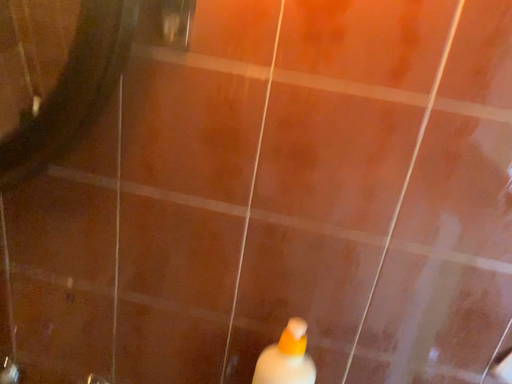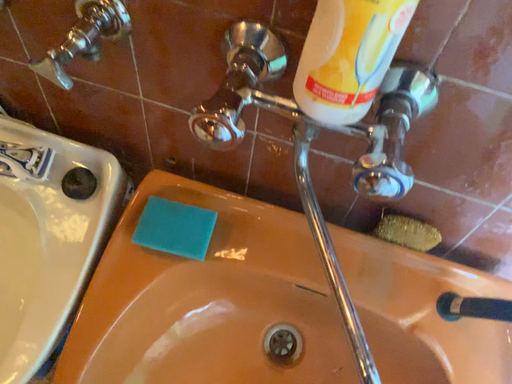
Question: How did the camera likely rotate when shooting the video?

Choices:
 (A) rotated right
 (B) rotated left

Answer: (B)